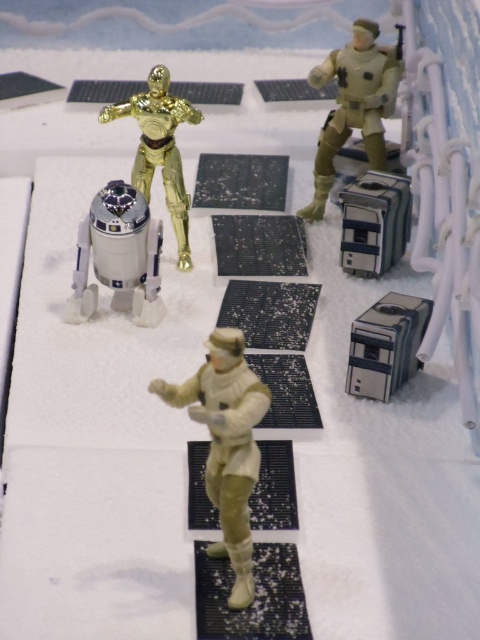
You are a collector organizing a Star Wars diorama. You need to place the light beige plastic astronaut at center and the gold metallic figure at upper center in a way that maintains their original positions relative to each other. If you want to add a new figure between them, where should you place it?

The light beige plastic astronaut at center is to the right of the gold metallic figure at upper center. To place a new figure between them, position it between the gold metallic figure at upper center and the light beige plastic astronaut at center, maintaining their relative positions.

You are a character in the Star Wars universe who needs to communicate with the white metallic robot at center. Considering the distance between you and the robot, can you comfortably reach out and touch it without moving from your current position?

The white metallic robot at center is 6.39 feet away from the camera, so you cannot comfortably reach out and touch it without moving closer.

In the Star Wars diorama scene, there is a white metallic robot at center and a metallic gray computer at center. Which object is wider?

The white metallic robot at center is wider than the metallic gray computer at center.